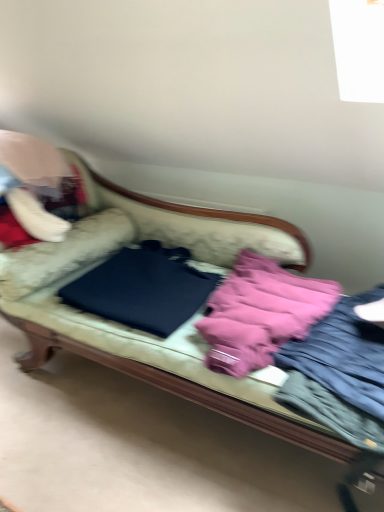
Question: Is velvet fabric couch at center facing towards pink fabric jacket at right?

Choices:
 (A) no
 (B) yes

Answer: (B)

Question: Is velvet fabric couch at center turned away from pink fabric jacket at right?

Choices:
 (A) no
 (B) yes

Answer: (A)

Question: From a real-world perspective, is velvet fabric couch at center on pink fabric jacket at right?

Choices:
 (A) no
 (B) yes

Answer: (A)

Question: Would you say velvet fabric couch at center is a long distance from pink fabric jacket at right?

Choices:
 (A) yes
 (B) no

Answer: (B)

Question: Considering the relative sizes of velvet fabric couch at center and pink fabric jacket at right in the image provided, is velvet fabric couch at center smaller than pink fabric jacket at right?

Choices:
 (A) no
 (B) yes

Answer: (A)

Question: Would you say velvet fabric couch at center is outside pink fabric jacket at right?

Choices:
 (A) no
 (B) yes

Answer: (B)

Question: Is pink fabric at center positioned with its back to pink fabric jacket at right?

Choices:
 (A) yes
 (B) no

Answer: (B)

Question: Is pink fabric at center positioned beyond the bounds of pink fabric jacket at right?

Choices:
 (A) yes
 (B) no

Answer: (A)

Question: Is pink fabric at center facing towards pink fabric jacket at right?

Choices:
 (A) no
 (B) yes

Answer: (A)

Question: Is pink fabric at center closer to the viewer compared to pink fabric jacket at right?

Choices:
 (A) yes
 (B) no

Answer: (B)

Question: Can you confirm if pink fabric at center is taller than pink fabric jacket at right?

Choices:
 (A) no
 (B) yes

Answer: (B)

Question: Is pink fabric at center smaller than pink fabric jacket at right?

Choices:
 (A) no
 (B) yes

Answer: (A)

Question: Does black matte laptop at center have a greater width compared to pink fabric jacket at right?

Choices:
 (A) no
 (B) yes

Answer: (A)